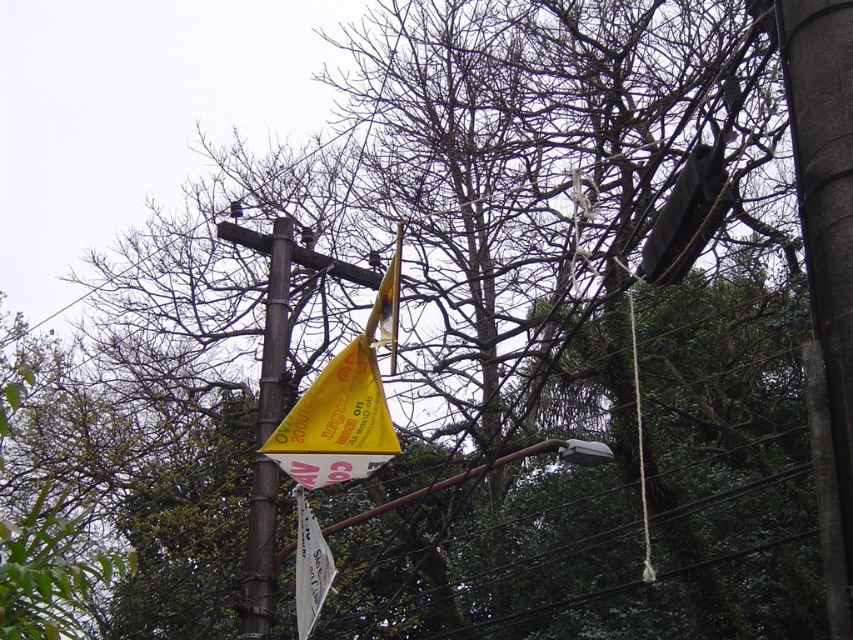
You are a city planner assessing the urban space. You need to place a new rectangular billboard that is 1.5 meters wide between the wooden telegraph pole at center and the white paper sign at lower center. Based on their sizes, will the billboard fit without overlapping either object?

The wooden telegraph pole at center is larger than the white paper sign at lower center. Since the billboard is 1.5 meters wide, it depends on the available space between them. However, the description only provides size comparison between the two objects, not the distance between them. Therefore, it is impossible to determine if the billboard will fit without additional information about the spacing between the wooden telegraph pole at center and the white paper sign at lower center.

You are a city planner reviewing this area. You need to install a new emergency beacon that must be placed to the right of the metallic gray streetlight at upper center. Is the rusty metal telegraph pole at center currently in the way of this installation?

The rusty metal telegraph pole at center is positioned on the left side of the metallic gray streetlight at upper center, so it is not in the way of installing the beacon to the right of the metallic gray streetlight at upper center.

You are a pedestrian walking along the street and see the rusty metal telegraph pole at center and the metallic gray streetlight at upper center. Which object is closer to you?

The rusty metal telegraph pole at center is closer to you since it is further to the viewer than the metallic gray streetlight at upper center, meaning it appears in front of the streetlight.